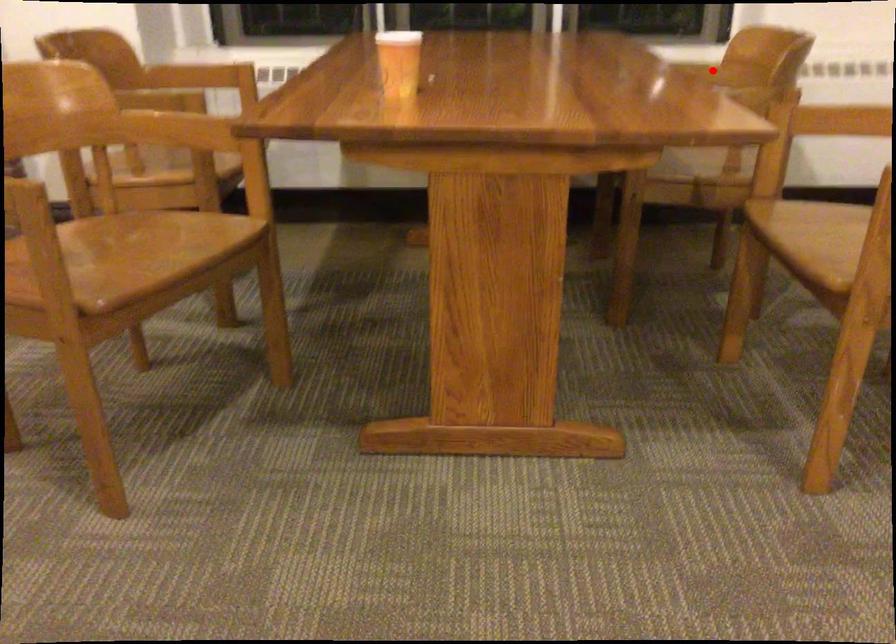
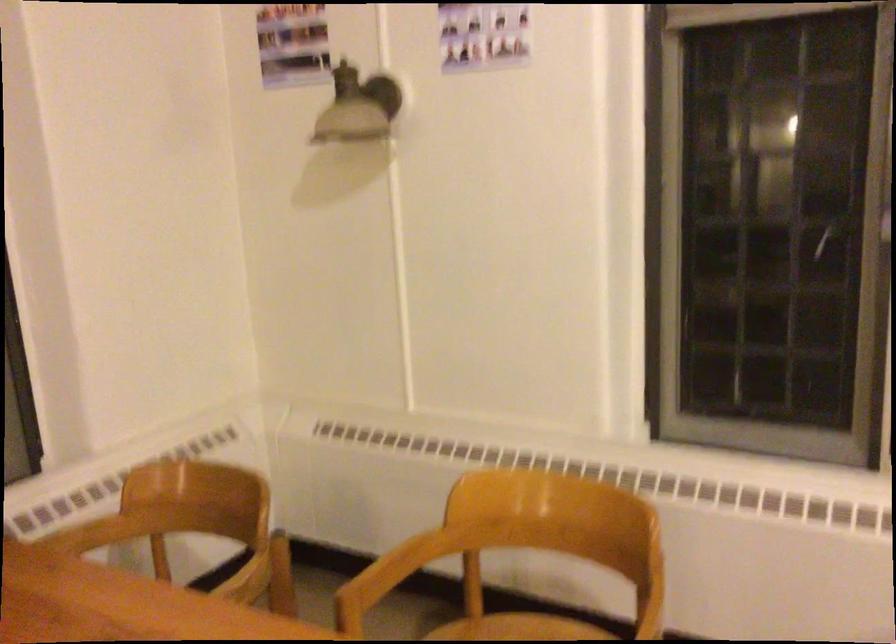
Question: I am providing you with two images of the same scene from different viewpoints. A red point is shown in image1. For the corresponding object point in image2, is it positioned nearer or farther from the camera?

Choices:
 (A) Nearer
 (B) Farther

Answer: (A)